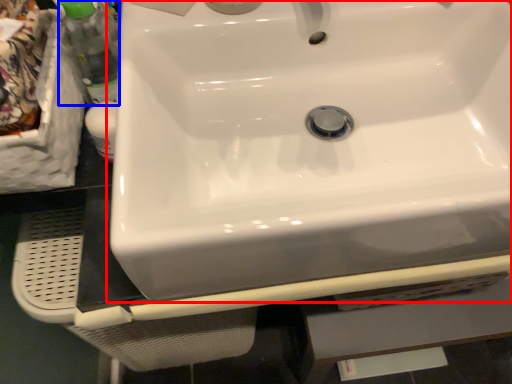
Question: Among these objects, which one is nearest to the camera, sink (highlighted by a red box) or bottle (highlighted by a blue box)?

Choices:
 (A) sink
 (B) bottle

Answer: (A)